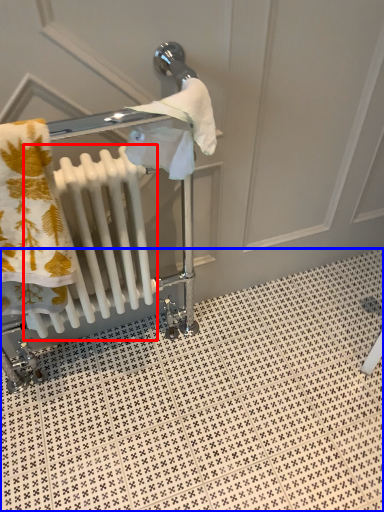
Question: Which point is closer to the camera, radiator (highlighted by a red box) or tile (highlighted by a blue box)?

Choices:
 (A) radiator
 (B) tile

Answer: (A)